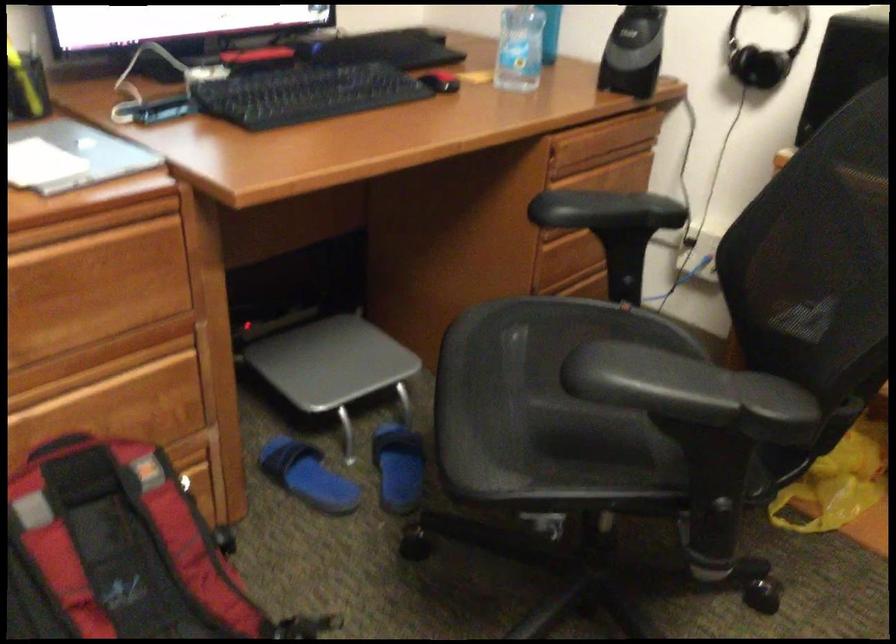
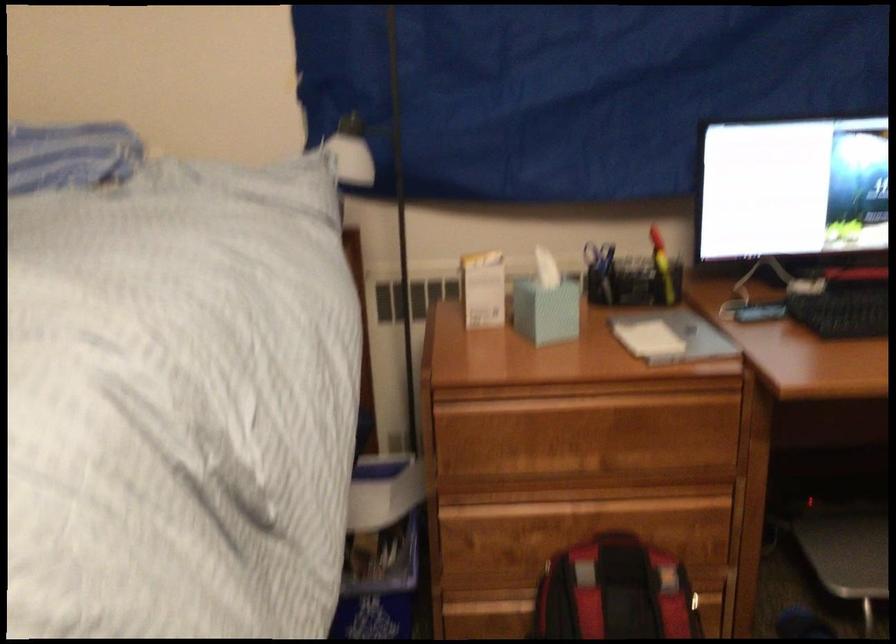
Where in the second image is the point corresponding to [87,527] from the first image?

(615, 592)